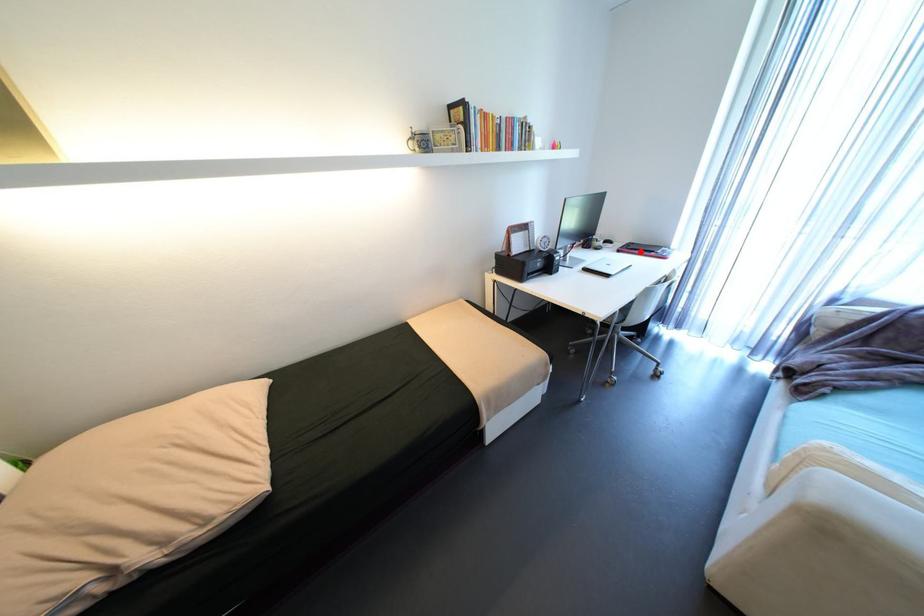
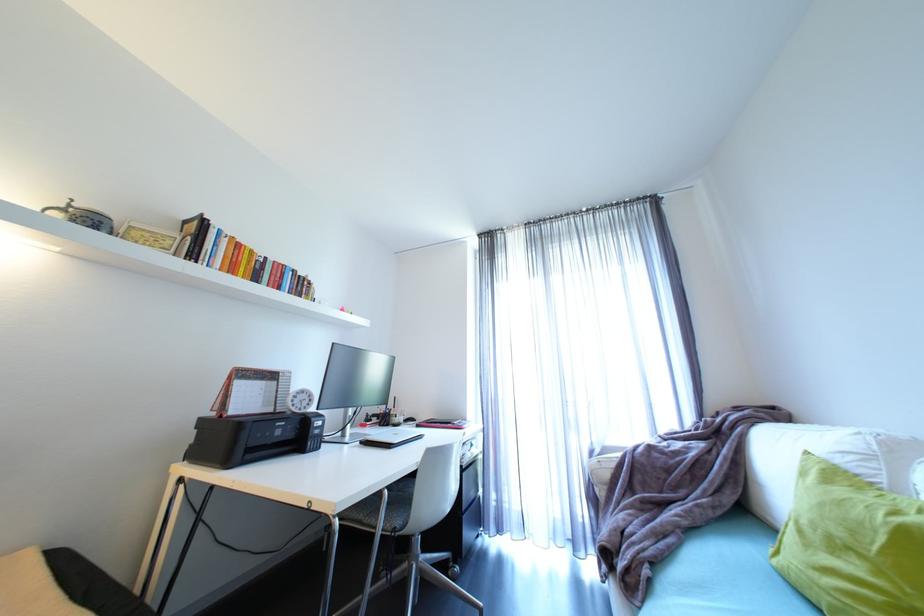
Question: I am providing you with two images of the same scene from different viewpoints. A red point is marked on the first image. Can you still see the location of the red point in image 2?

Choices:
 (A) Yes
 (B) No

Answer: (A)